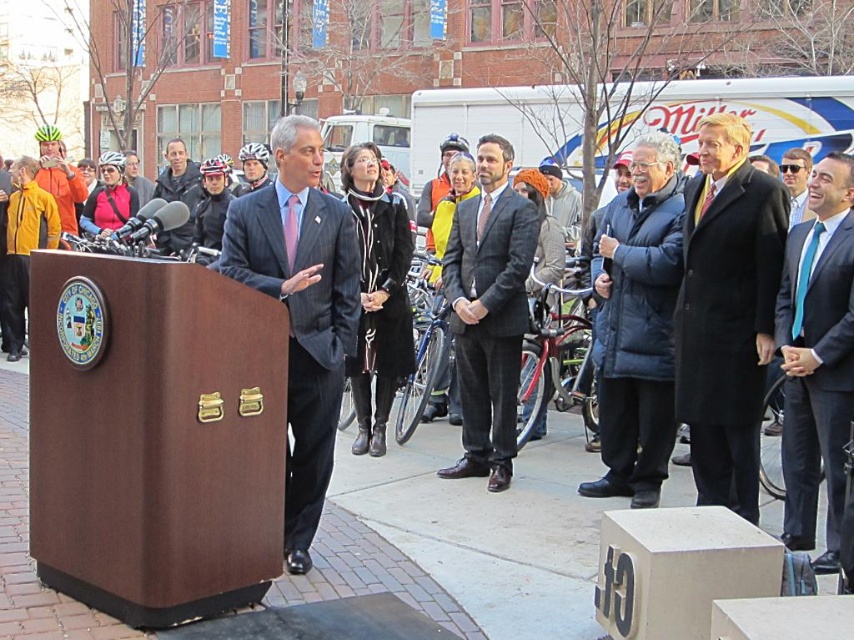
You are attending a public event in Chicago and notice two items of clothing. The orange jacket at left and the blue silk tie at center. Which item is taller?

The orange jacket at left is much taller than the blue silk tie at center.

You are a photographer at the event and need to capture a photo of both the orange jacket at left and the matte black helmet at upper left in the same frame. Which object should you zoom in on to ensure both are visible without cropping?

The orange jacket at left is wider than the matte black helmet at upper left, so you should zoom in on the orange jacket at left to ensure both objects fit in the frame.